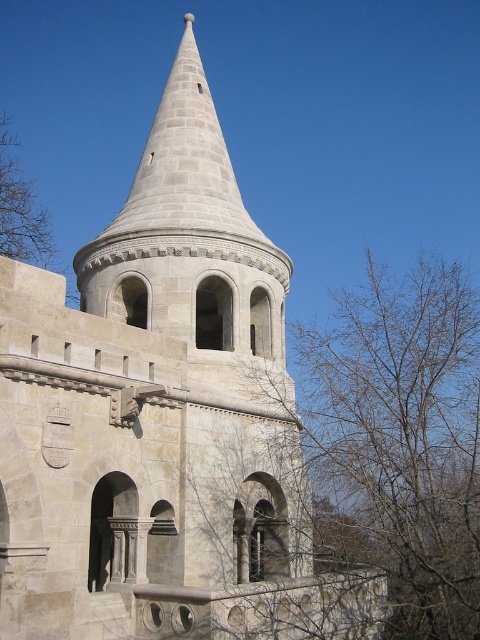
Based on the photo, you are standing in front of the historic stone structure and notice two trees in the scene. Which one, the bare branches at lower right or the brown leafless tree at upper left, is closer to you?

The bare branches at lower right is closer to the viewer than the brown leafless tree at upper left.

You are an archer positioned at the base of the historic stone structure. You notice two landmarks in your line of sight for aiming an arrow at a distant target. The landmarks are the bare branches at lower right and the brown leafless tree at upper left. Which landmark is closer to you?

The bare branches at lower right is 139.22 feet away from the brown leafless tree at upper left. Since the distance between them is given, but without knowing their individual distances from the observer, we cannot determine which is closer based solely on this information. Additional information about their positions relative to the observer is needed to answer accurately.

You are an architect analyzing a historic structure. You observe the bare branches at lower right and the brown leafless tree at upper left in the scene. Which of these two objects occupies a greater area in the image?

The bare branches at lower right has a larger size compared to brown leafless tree at upper left, so the bare branches at lower right occupies a greater area in the image.